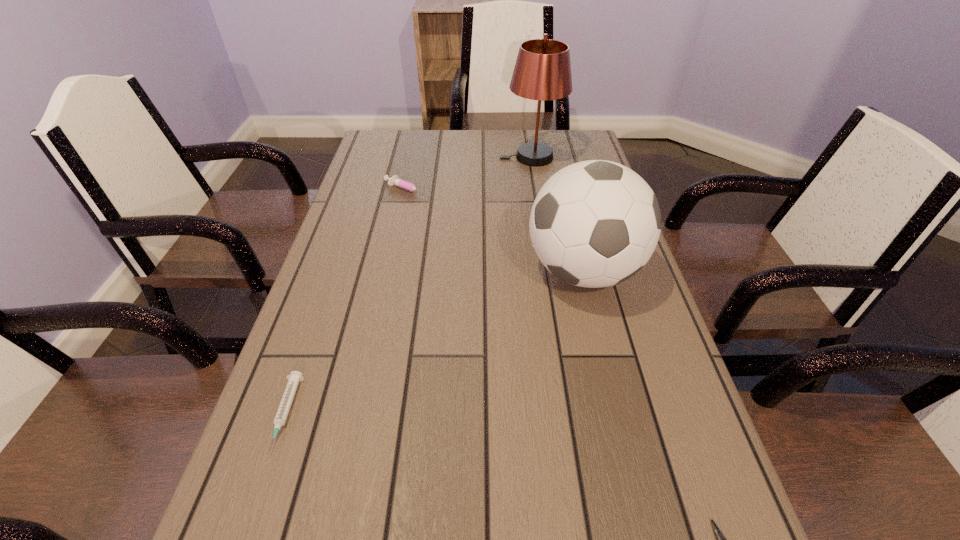
Where is `blank area located 0.050m on the front-facing side of the tallest object`? blank area located 0.050m on the front-facing side of the tallest object is located at coordinates (485, 157).

Where is `free point located on the left of the third nearest object`? free point located on the left of the third nearest object is located at coordinates [432, 271].

Find the location of `vacant space located 0.090m on the left of the fourth object from right to left`. vacant space located 0.090m on the left of the fourth object from right to left is located at coordinates (352, 190).

Locate an element on the screen. The height and width of the screenshot is (540, 960). vacant point located 0.050m at the needle end of the leftmost object is located at coordinates (260, 488).

In order to click on object present at the far edge in this screenshot , I will do `click(542, 72)`.

Locate an element on the screen. lampshade that is at the right edge is located at coordinates (542, 72).

Image resolution: width=960 pixels, height=540 pixels. I want to click on soccer ball that is at the right edge, so click(596, 223).

You are a GUI agent. You are given a task and a screenshot of the screen. Output one action in this format:
    pyautogui.click(x=<x>, y=<y>)
    Task: Click on the object located at the far right corner
    This screenshot has width=960, height=540.
    Given the screenshot: What is the action you would take?
    [x=542, y=72]

Identify the location of free space at the far edge of the desktop. (510, 148).

The width and height of the screenshot is (960, 540). I want to click on vacant area at the left edge, so click(x=310, y=340).